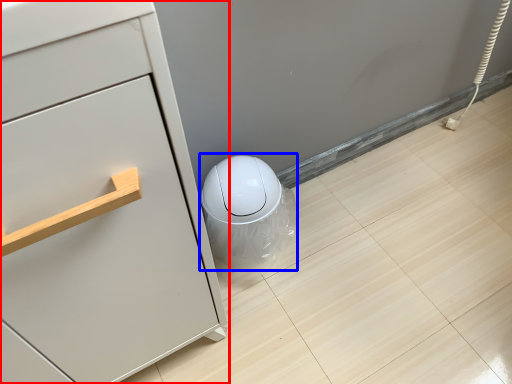
Question: Which object is closer to the camera taking this photo, chest of drawers (highlighted by a red box) or porcelain (highlighted by a blue box)?

Choices:
 (A) chest of drawers
 (B) porcelain

Answer: (A)